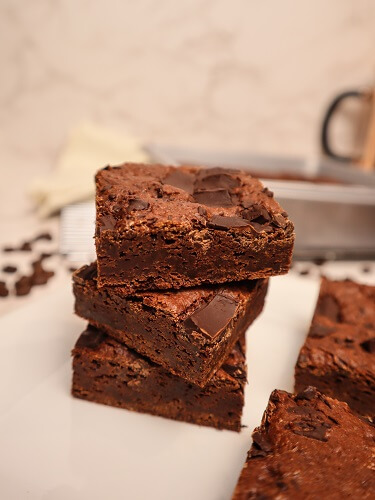
At what (x,y) coordinates should I click in order to perform the action: click on backsplash. Please return your answer as a coordinate pair (x, y). This screenshot has width=375, height=500. Looking at the image, I should click on (202, 62).